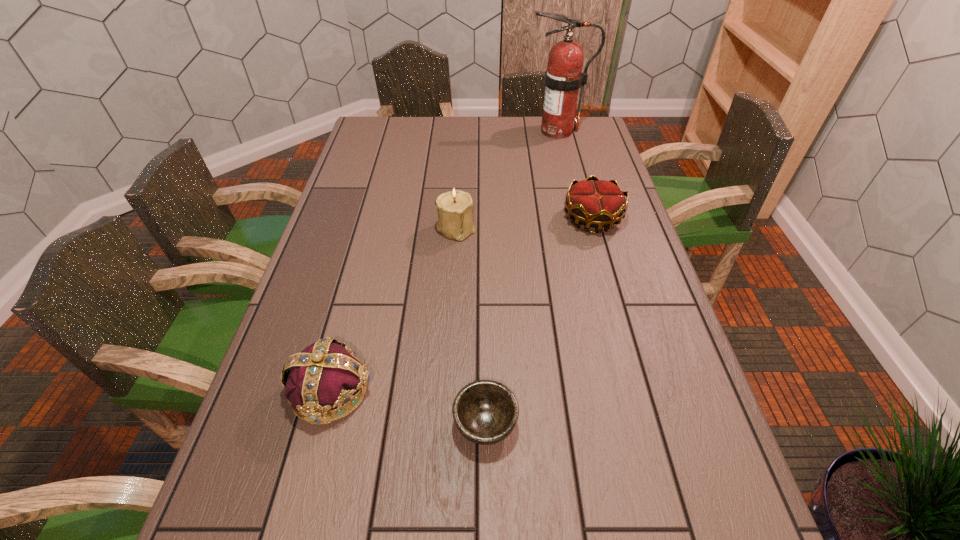
Identify the location of vacant area at the far edge. (405, 139).

Find the location of a particular element. The height and width of the screenshot is (540, 960). free region at the left edge of the desktop is located at coordinates (340, 242).

Where is `free region at the right edge of the desktop`? Image resolution: width=960 pixels, height=540 pixels. free region at the right edge of the desktop is located at coordinates (656, 409).

In the image, there is a desktop. Identify the location of vacant space at the far left corner. This screenshot has height=540, width=960. click(x=381, y=138).

I want to click on blank region between the shorter crown and the tallest object, so click(x=575, y=174).

Where is `unoccupied area between the candle_holder and the third tallest object`? The height and width of the screenshot is (540, 960). unoccupied area between the candle_holder and the third tallest object is located at coordinates (394, 309).

The image size is (960, 540). In order to click on free spot between the farthest object and the second shortest object in this screenshot , I will do `click(575, 174)`.

Locate an element on the screen. This screenshot has height=540, width=960. vacant point located between the farther crown and the left crown is located at coordinates (462, 304).

At what (x,y) coordinates should I click in order to perform the action: click on vacant area that lies between the farthest object and the farther crown. Please return your answer as a coordinate pair (x, y). This screenshot has width=960, height=540. Looking at the image, I should click on (575, 174).

You are a GUI agent. You are given a task and a screenshot of the screen. Output one action in this format:
    pyautogui.click(x=<x>, y=<y>)
    Task: Click on the free space that is in between the fire extinguisher and the taller crown
    Image resolution: width=960 pixels, height=540 pixels.
    Given the screenshot: What is the action you would take?
    pyautogui.click(x=444, y=261)